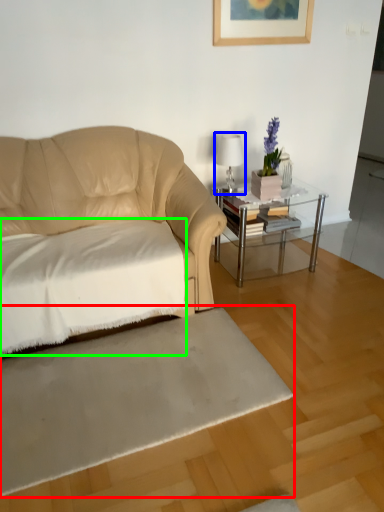
Question: Which object is the closest to the flat (highlighted by a red box)? Choose among these: table lamp (highlighted by a blue box) or sheet (highlighted by a green box).

Choices:
 (A) table lamp
 (B) sheet

Answer: (B)